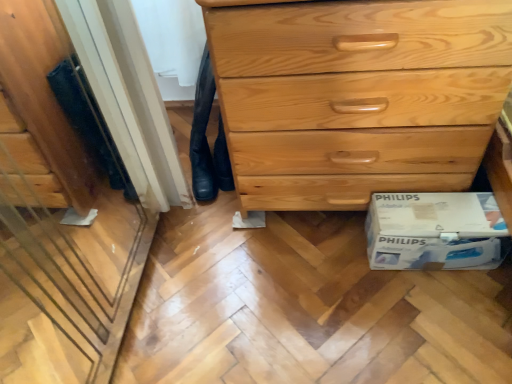
Where is `vacant area situated to the left side of light wood chest of drawers at center`? This screenshot has width=512, height=384. vacant area situated to the left side of light wood chest of drawers at center is located at coordinates (180, 252).